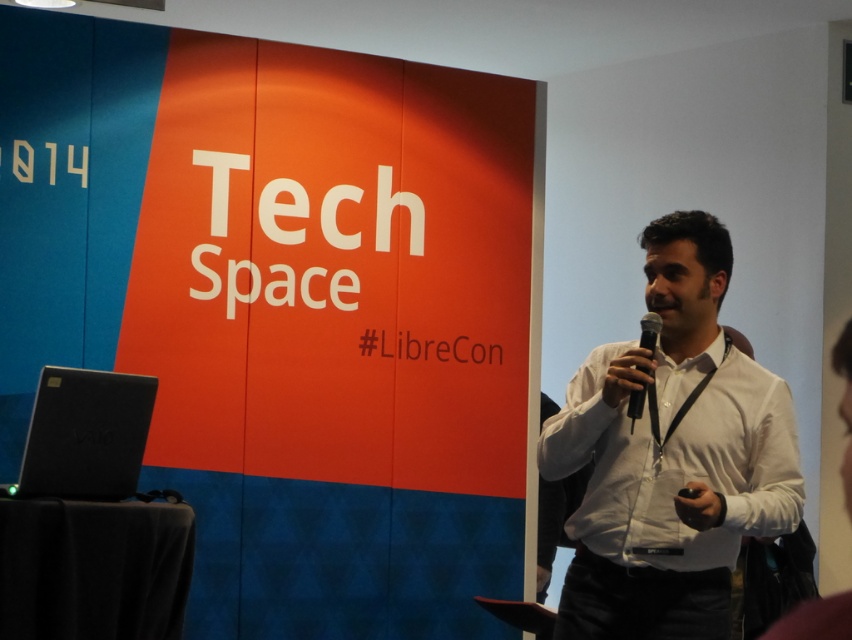
You are attending a tech conference and see the white shirt at center and the black matte microphone at center. Which object is closer to you?

The white shirt at center is closer to you because it is in front of the black matte microphone at center.

Based on the photo, you are attending the LibreCon conference and notice two items at the center of the image. Which one is positioned to the right of the other? The items are the white shirt at center and the black matte microphone at center.

The white shirt at center is positioned to the right of the black matte microphone at center.